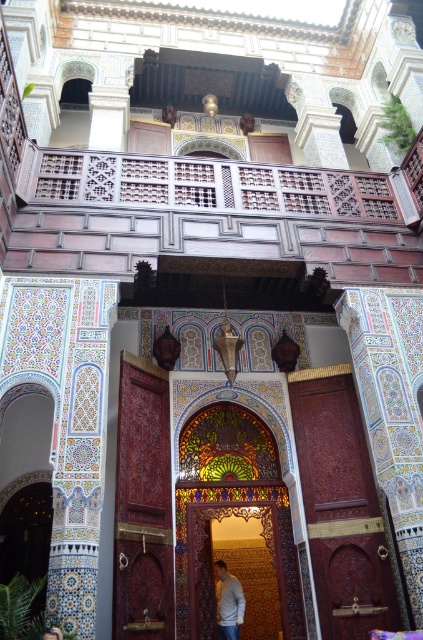
Measure the distance between point (283, 582) and camera.

A distance of 39.77 meters exists between point (283, 582) and camera.

Can you confirm if carved wood door at center is smaller than light gray sweater at center?

No.

Is point (285, 550) closer to camera compared to point (217, 609)?

Yes, point (285, 550) is closer to viewer.

You are a GUI agent. You are given a task and a screenshot of the screen. Output one action in this format:
    pyautogui.click(x=<x>, y=<y>)
    Task: Click on the carved wood door at center
    The image size is (423, 640).
    Given the screenshot: What is the action you would take?
    pyautogui.click(x=225, y=564)

How much distance is there between light gray sweater at center and light brown hair at center?

A distance of 23.02 meters exists between light gray sweater at center and light brown hair at center.

Between light gray sweater at center and light brown hair at center, which one appears on the right side from the viewer's perspective?

light gray sweater at center

What do you see at coordinates (227, 602) in the screenshot? The height and width of the screenshot is (640, 423). I see `light gray sweater at center` at bounding box center [227, 602].

Image resolution: width=423 pixels, height=640 pixels. What are the coordinates of `light gray sweater at center` in the screenshot? It's located at (227, 602).

Is carved wood door at center to the left of light brown hair at center from the viewer's perspective?

No, carved wood door at center is not to the left of light brown hair at center.

Is carved wood door at center wider than light brown hair at center?

Correct, the width of carved wood door at center exceeds that of light brown hair at center.

Is point (216, 506) less distant than point (57, 630)?

No, (216, 506) is further to viewer.

Image resolution: width=423 pixels, height=640 pixels. I want to click on carved wood door at center, so click(225, 564).